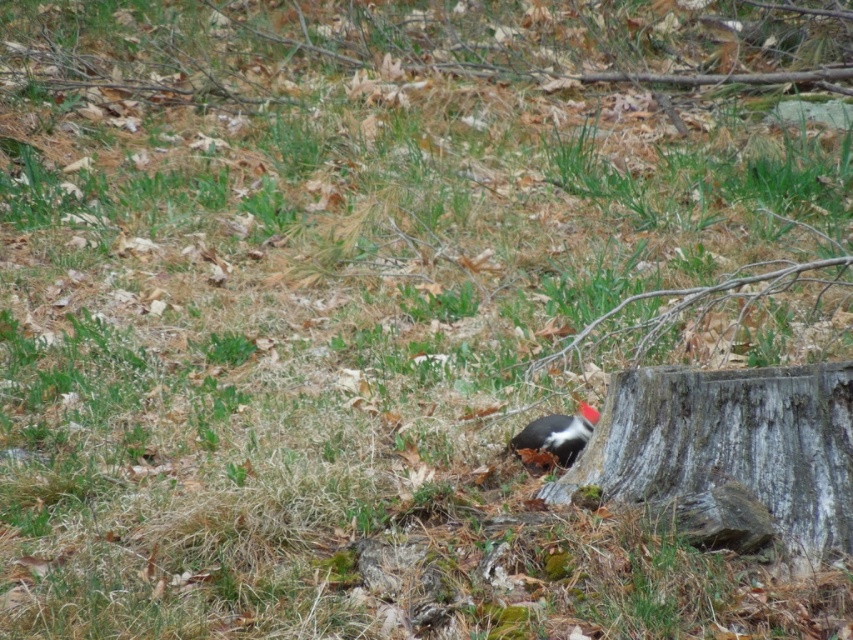
Does gray rough tree trunk at lower right have a larger size compared to black matte woodpecker at center?

Indeed, gray rough tree trunk at lower right has a larger size compared to black matte woodpecker at center.

Is gray rough tree trunk at lower right taller than black matte woodpecker at center?

Indeed, gray rough tree trunk at lower right has a greater height compared to black matte woodpecker at center.

This screenshot has width=853, height=640. Find the location of `gray rough tree trunk at lower right`. gray rough tree trunk at lower right is located at coordinates (730, 444).